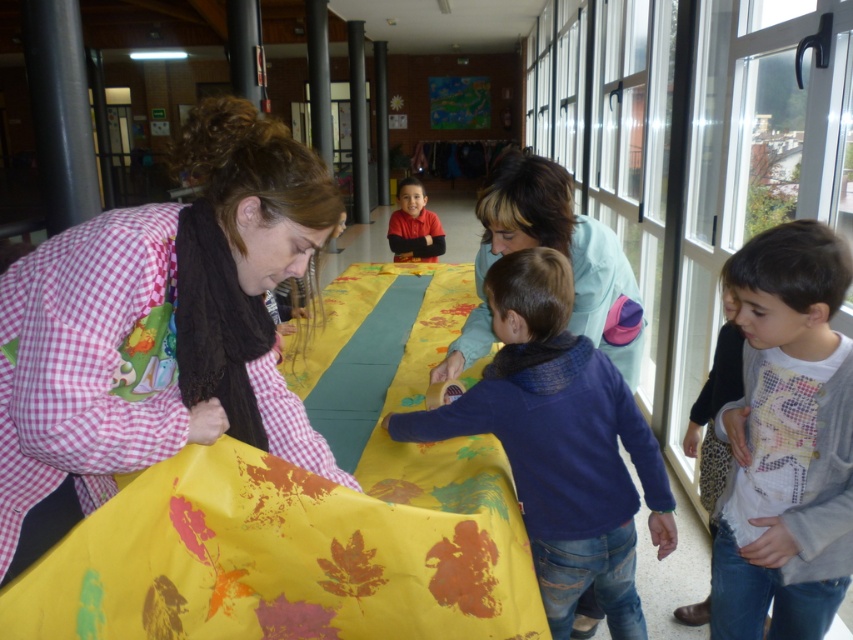
Which is below, pink checkered shirt at lower left or white printed sweater at lower right?

Positioned lower is white printed sweater at lower right.

Which is behind, point (241, 278) or point (842, 349)?

The point (842, 349) is more distant.

At what (x,y) coordinates should I click in order to perform the action: click on pink checkered shirt at lower left. Please return your answer as a coordinate pair (x, y). Looking at the image, I should click on (157, 330).

Between white printed sweater at lower right and blue fleece sweater at center, which one is positioned lower?

blue fleece sweater at center

Does white printed sweater at lower right have a lesser width compared to blue fleece sweater at center?

Yes.

Does point (809, 504) come behind point (583, 588)?

No, (809, 504) is closer to viewer.

Identify the location of white printed sweater at lower right. The width and height of the screenshot is (853, 640). (787, 440).

Is pink checkered shirt at lower left smaller than blue fleece sweater at center?

Yes, pink checkered shirt at lower left is smaller than blue fleece sweater at center.

Is pink checkered shirt at lower left wider than blue fleece sweater at center?

In fact, pink checkered shirt at lower left might be narrower than blue fleece sweater at center.

Where is `pink checkered shirt at lower left`? The height and width of the screenshot is (640, 853). pink checkered shirt at lower left is located at coordinates (157, 330).

The width and height of the screenshot is (853, 640). I want to click on pink checkered shirt at lower left, so click(157, 330).